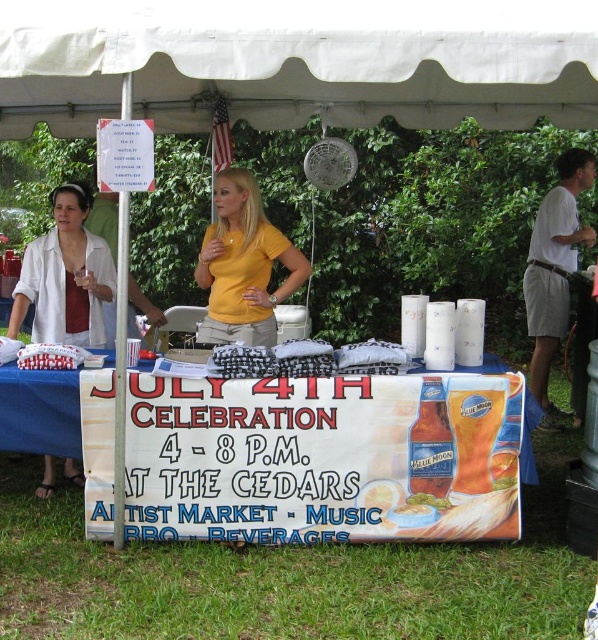
You are a visitor at the event and want to take a photo under the white fabric canopy at upper center. However, you notice the matte white blouse at left might block your view. Based on their heights, can you stand in a position where the canopy is visible without the blouse blocking it?

The white fabric canopy at upper center is not as tall as the matte white blouse at left, so the blouse would likely block the view of the canopy if you stand directly in front. To see the canopy without obstruction, you would need to position yourself where the blouse is not between you and the canopy, such as to the side or behind the table.

You are a visitor at the event and want to pick up both items, the matte white blouse at left and the white cotton shirt at upper right. If you can only reach items within 3 meters, can you grab both without moving your position?

The matte white blouse at left is 2.70 meters from the white cotton shirt at upper right. Since you can reach items within 3 meters, you can grab both items without moving your position as the distance between them is within your reach limit.